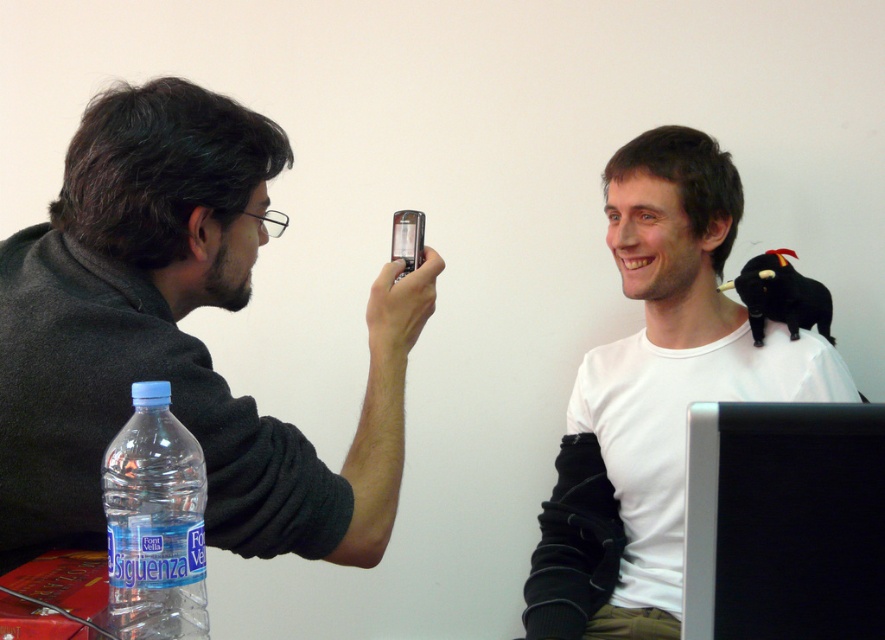
Between black glossy monitor at lower right and transparent plastic bottle at lower left, which one appears on the left side from the viewer's perspective?

transparent plastic bottle at lower left

Who is more distant from viewer, [855,461] or [129,573]?

Point [855,461]

Where is `black glossy monitor at lower right`? This screenshot has width=885, height=640. black glossy monitor at lower right is located at coordinates (783, 522).

How far apart are white matte plush toy at upper right and satin black phone at center?

white matte plush toy at upper right and satin black phone at center are 24.46 inches apart from each other.

Between white matte plush toy at upper right and satin black phone at center, which one is positioned higher?

satin black phone at center is higher up.

At what (x,y) coordinates should I click in order to perform the action: click on white matte plush toy at upper right. Please return your answer as a coordinate pair (x, y). The height and width of the screenshot is (640, 885). Looking at the image, I should click on (666, 388).

The height and width of the screenshot is (640, 885). What are the coordinates of `white matte plush toy at upper right` in the screenshot? It's located at (666, 388).

Does point (50, 536) lie in front of point (637, 147)?

Yes, it is in front of point (637, 147).

Who is more forward, (229, 298) or (759, 321)?

Point (229, 298) is in front.

Which is behind, point (19, 550) or point (640, 291)?

The point (640, 291) is more distant.

Locate an element on the screen. matte black phone at left is located at coordinates coord(178,337).